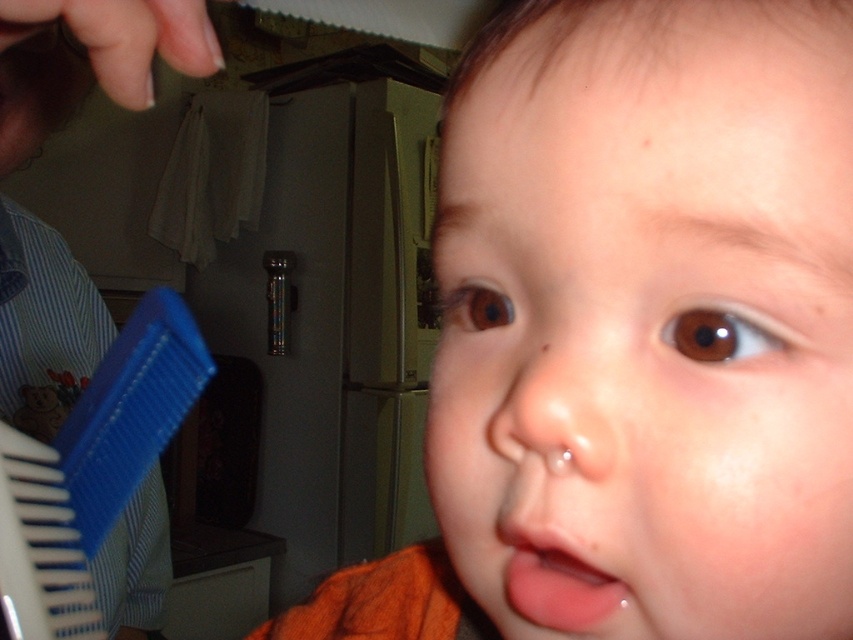
You are a photographer adjusting the focus on your camera. You notice two points in the image at coordinates point [665,540] and point [13,122]. Which point should you focus on to capture the baby clearly?

Point [665,540] is in front of point [13,122], so focusing on point [665,540] will ensure the baby is captured clearly.

You are a photographer standing 6 feet away from the smooth skin baby at center. You want to take a closeup photo of the baby. Is the current distance sufficient for a clear closeup?

The smooth skin baby at center is 6.49 inches away from the viewer. Since you are standing 6 feet away, which is much farther than 6.49 inches, the distance is not sufficient for a clear closeup photo.

You are holding a small toy that is 3 inches wide. You want to place it on a surface so that it is exactly between the point at coordinates point [184,51] and yourself. Can you do this without the toy overlapping either the point or your position?

The distance between point [184,51] and the viewer is 9.72 inches. Placing the toy exactly in the middle would require 4.86 inches from each end. Since the toy is 3 inches wide, there will be 1.86 inches of space on both sides, so yes, it can be placed without overlapping.